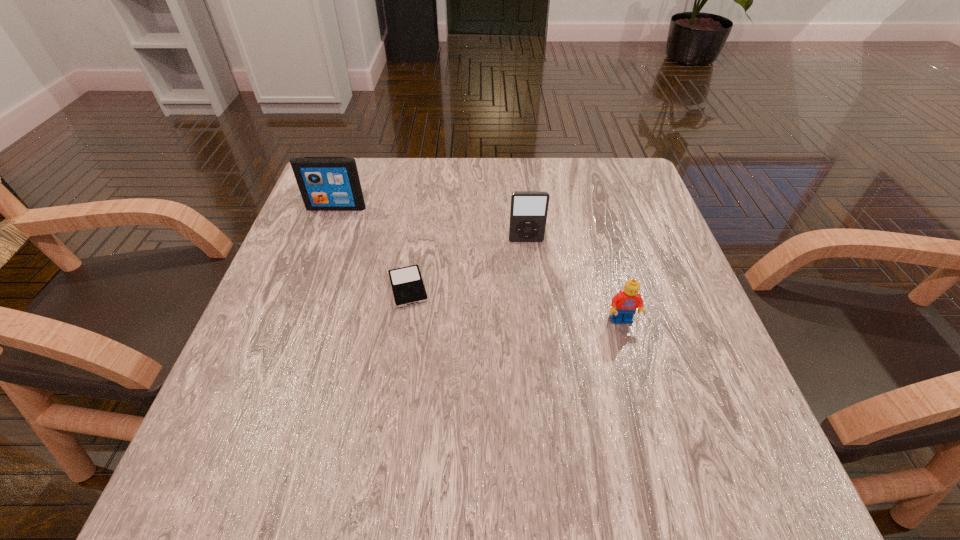
Where is `vacant area that lies between the farthest object and the second nearest iPod`? The height and width of the screenshot is (540, 960). vacant area that lies between the farthest object and the second nearest iPod is located at coordinates (431, 224).

This screenshot has width=960, height=540. Find the location of `object that is the third nearest to the Lego`. object that is the third nearest to the Lego is located at coordinates (326, 183).

Identify the location of object identified as the second closest to the nearest object. The image size is (960, 540). (408, 288).

Locate which iPod ranks in proximity to the third object from left to right. Please provide its 2D coordinates. Your answer should be formatted as a tuple, i.e. [(x, y)], where the tuple contains the x and y coordinates of a point satisfying the conditions above.

[(408, 288)]

Find the location of `iPod that stands as the closest to the farthest object`. iPod that stands as the closest to the farthest object is located at coordinates (408, 288).

At what (x,y) coordinates should I click in order to perform the action: click on vacant space that satisfies the following two spatial constraints: 1. on the front screen of the leftmost iPod; 2. on the right side of the third farthest object. Please return your answer as a coordinate pair (x, y). This screenshot has height=540, width=960. Looking at the image, I should click on (306, 287).

Find the location of `vacant area that satisfies the following two spatial constraints: 1. on the front screen of the farthest object; 2. on the left side of the shortest object`. vacant area that satisfies the following two spatial constraints: 1. on the front screen of the farthest object; 2. on the left side of the shortest object is located at coordinates (306, 287).

Where is `blank space that satisfies the following two spatial constraints: 1. on the front screen of the farthest iPod; 2. on the right side of the third farthest object`? The image size is (960, 540). blank space that satisfies the following two spatial constraints: 1. on the front screen of the farthest iPod; 2. on the right side of the third farthest object is located at coordinates (306, 287).